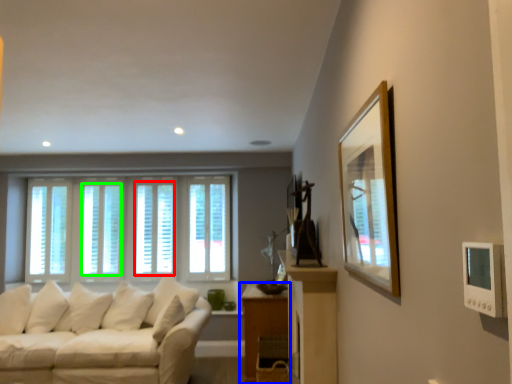
Question: Estimate the real-world distances between objects in this image. Which object is closer to window (highlighted by a red box), table (highlighted by a blue box) or window (highlighted by a green box)?

Choices:
 (A) table
 (B) window

Answer: (B)